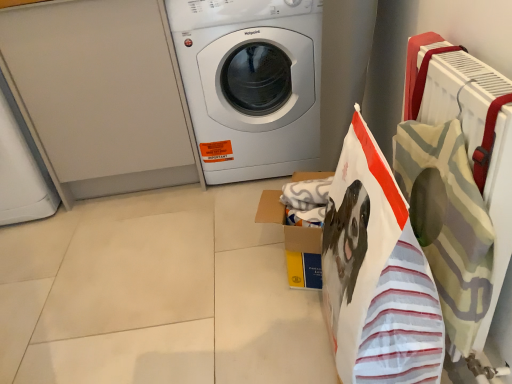
Locate an element on the screen. Image resolution: width=512 pixels, height=384 pixels. vacant position to the left of yellow cardboard box at center is located at coordinates (231, 278).